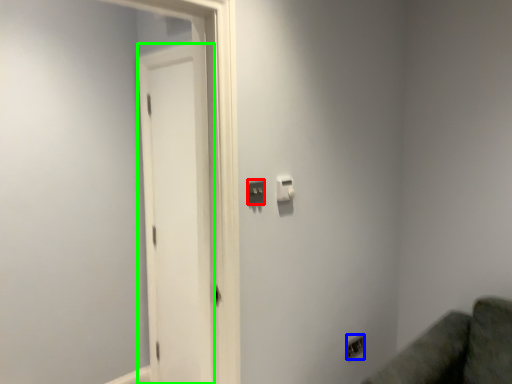
Question: Estimate the real-world distances between objects in this image. Which object is farther from light switch (highlighted by a red box), electric outlet (highlighted by a blue box) or screen door (highlighted by a green box)?

Choices:
 (A) electric outlet
 (B) screen door

Answer: (A)